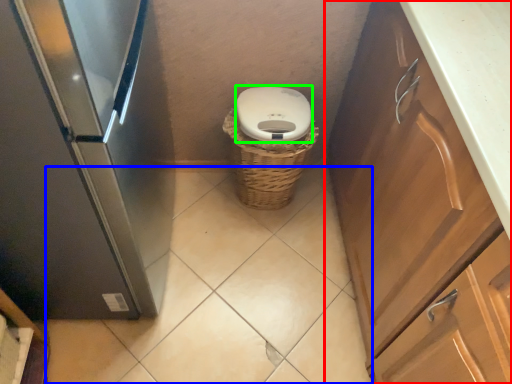
Question: Which object is positioned closest to cabinetry (highlighted by a red box)? Select from plain (highlighted by a blue box) and toilet bowl (highlighted by a green box).

Choices:
 (A) plain
 (B) toilet bowl

Answer: (B)